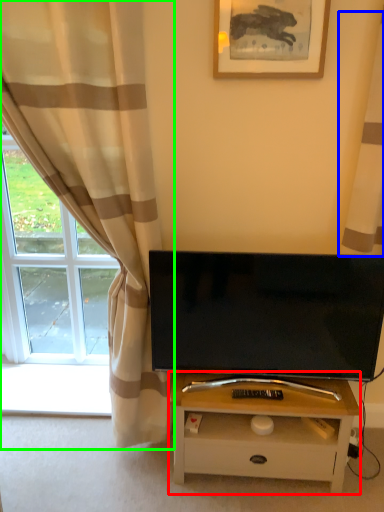
Question: Which is farther away from table (highlighted by a red box)? curtain (highlighted by a blue box) or curtain (highlighted by a green box)?

Choices:
 (A) curtain
 (B) curtain

Answer: (A)